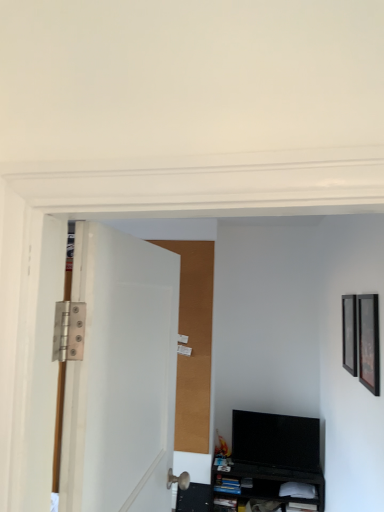
This screenshot has width=384, height=512. Describe the element at coordinates (276, 440) in the screenshot. I see `black glossy tv at lower right` at that location.

Describe the element at coordinates (194, 498) in the screenshot. The image size is (384, 512). I see `black matte shelf at lower center` at that location.

Image resolution: width=384 pixels, height=512 pixels. What do you see at coordinates (369, 342) in the screenshot?
I see `black glossy picture frame at right, the second picture frame when ordered from back to front` at bounding box center [369, 342].

Measure the distance between point (360, 362) and camera.

The distance of point (360, 362) from camera is 2.26 meters.

What are the coordinates of `black matte cabinet at lower center` in the screenshot? It's located at (264, 483).

Does black matte cabinet at lower center have a greater height compared to black matte shelf at lower center?

Correct, black matte cabinet at lower center is much taller as black matte shelf at lower center.

Considering the positions of point (239, 495) and point (188, 487), is point (239, 495) closer or farther from the camera than point (188, 487)?

Point (239, 495) appears to be closer to the viewer than point (188, 487).

Are black matte cabinet at lower center and black matte shelf at lower center beside each other?

They are not placed beside each other.

From the image's perspective, between black matte cabinet at lower center and black matte shelf at lower center, who is located below?

black matte shelf at lower center is shown below in the image.

Is white matte door at left to the left or to the right of black glossy tv at lower right in the image?

white matte door at left is to the left of black glossy tv at lower right.

From the image's perspective, who appears lower, white matte door at left or black glossy tv at lower right?

black glossy tv at lower right is shown below in the image.

Considering the relative sizes of white matte door at left and black glossy tv at lower right in the image provided, is white matte door at left wider than black glossy tv at lower right?

Yes.

Locate an element on the screen. Image resolution: width=384 pixels, height=512 pixels. door below the black glossy picture frame at right, placed as the first picture frame when sorted from left to right (from a real-world perspective) is located at coordinates (121, 375).

From the image's perspective, relative to black glossy picture frame at right, the 2th picture frame from the right, is white matte door at left above or below?

white matte door at left is above black glossy picture frame at right, the 2th picture frame from the right.

Is white matte door at left to the left of black glossy picture frame at right, the 1th picture frame positioned from the front, from the viewer's perspective?

Yes, white matte door at left is to the left of black glossy picture frame at right, the 1th picture frame positioned from the front.

Between point (91, 277) and point (359, 329), which one is positioned in front?

The point (91, 277) is in front.

Is white matte door at left completely or partially inside black glossy picture frame at right, the 1th picture frame positioned from the front?

No, black glossy picture frame at right, the 1th picture frame positioned from the front, does not contain white matte door at left.

Identify the location of door in front of the black glossy picture frame at right, the 2th picture frame from the right. (121, 375).

Between black glossy picture frame at right, the 2th picture frame from the right, and white matte door at left, which one appears on the right side from the viewer's perspective?

Positioned to the right is black glossy picture frame at right, the 2th picture frame from the right.

Based on the photo, can you confirm if black glossy picture frame at right, the 1th picture frame positioned from the front, is shorter than white matte door at left?

Correct, black glossy picture frame at right, the 1th picture frame positioned from the front, is not as tall as white matte door at left.

Are black glossy picture frame at right, the second picture frame when ordered from back to front, and black matte cabinet at lower center making contact?

No, black glossy picture frame at right, the second picture frame when ordered from back to front, is not next to black matte cabinet at lower center.

Could you tell me if black glossy picture frame at right, the second picture frame when ordered from back to front, is turned towards black matte cabinet at lower center?

No, black glossy picture frame at right, the second picture frame when ordered from back to front, is not aimed at black matte cabinet at lower center.

Between point (370, 357) and point (318, 487), which one is positioned in front?

The point (370, 357) is more forward.

Is black glossy picture frame at right, the second picture frame when ordered from back to front, completely or partially outside of black matte cabinet at lower center?

black glossy picture frame at right, the second picture frame when ordered from back to front, lies outside black matte cabinet at lower center's area.

Between black glossy tv at lower right and black glossy picture frame at right, the 1th picture frame positioned from the front, which one has smaller size?

black glossy picture frame at right, the 1th picture frame positioned from the front, is smaller.

Is black glossy tv at lower right facing towards black glossy picture frame at right, the 2th picture frame from the right?

No, black glossy tv at lower right is not turned towards black glossy picture frame at right, the 2th picture frame from the right.

The height and width of the screenshot is (512, 384). Find the location of `television that appears behind the black glossy picture frame at right, the second picture frame when ordered from back to front`. television that appears behind the black glossy picture frame at right, the second picture frame when ordered from back to front is located at coordinates (276, 440).

Is black glossy tv at lower right to the right of black glossy picture frame at right, placed as the first picture frame when sorted from left to right, from the viewer's perspective?

In fact, black glossy tv at lower right is to the left of black glossy picture frame at right, placed as the first picture frame when sorted from left to right.

Is black matte shelf at lower center aimed at black matte cabinet at lower center?

No, black matte shelf at lower center is not turned towards black matte cabinet at lower center.

From a real-world perspective, is black matte shelf at lower center located higher than black matte cabinet at lower center?

No.

Does black matte shelf at lower center appear on the left side of black matte cabinet at lower center?

Yes, black matte shelf at lower center is to the left of black matte cabinet at lower center.

Is black matte shelf at lower center not inside black matte cabinet at lower center?

Indeed, black matte shelf at lower center is completely outside black matte cabinet at lower center.

Identify the location of cabinetry positioned vertically above the black matte shelf at lower center (from a real-world perspective). click(264, 483).

Find the location of a particular element. The height and width of the screenshot is (512, 384). television lying behind the white matte door at left is located at coordinates (276, 440).

Estimate the real-world distances between objects in this image. Which object is further from black matte picture frame at right, the 2th picture frame when ordered from left to right, black glossy tv at lower right or white matte door at left?

black glossy tv at lower right lies further to black matte picture frame at right, the 2th picture frame when ordered from left to right, than the other object.

Considering their positions, is black matte cabinet at lower center positioned closer to black glossy tv at lower right than white matte door at left?

The object closer to black glossy tv at lower right is black matte cabinet at lower center.

Looking at the image, which one is located closer to black matte cabinet at lower center, black glossy picture frame at right, the second picture frame when ordered from back to front, or black matte picture frame at right, the 2th picture frame when ordered from left to right?

black matte picture frame at right, the 2th picture frame when ordered from left to right.

When comparing their distances from white matte door at left, does black matte cabinet at lower center or black matte shelf at lower center seem further?

Among the two, black matte cabinet at lower center is located further to white matte door at left.

Based on the photo, considering their positions, is black glossy tv at lower right positioned closer to white matte door at left than black matte cabinet at lower center?

black glossy tv at lower right is closer to white matte door at left.

Looking at the image, which one is located closer to black matte shelf at lower center, black matte picture frame at right, acting as the 2th picture frame starting from the front, or black glossy tv at lower right?

black glossy tv at lower right is closer to black matte shelf at lower center.

Looking at the image, which one is located further to white matte door at left, black matte shelf at lower center or black glossy tv at lower right?

Based on the image, black matte shelf at lower center appears to be further to white matte door at left.

From the picture: From the image, which object appears to be nearer to black glossy tv at lower right, white matte door at left or black matte shelf at lower center?

black matte shelf at lower center is positioned closer to the anchor black glossy tv at lower right.

This screenshot has width=384, height=512. Find the location of `picture frame between black glossy picture frame at right, the 1th picture frame positioned from the front, and black glossy tv at lower right from front to back`. picture frame between black glossy picture frame at right, the 1th picture frame positioned from the front, and black glossy tv at lower right from front to back is located at coordinates (349, 333).

Locate an element on the screen. picture frame between black glossy picture frame at right, the second picture frame when ordered from back to front, and black matte shelf at lower center from top to bottom is located at coordinates (349, 333).

The width and height of the screenshot is (384, 512). Find the location of `television between black matte picture frame at right, positioned as the 1th picture frame in right-to-left order, and black matte shelf at lower center vertically`. television between black matte picture frame at right, positioned as the 1th picture frame in right-to-left order, and black matte shelf at lower center vertically is located at coordinates (276, 440).

Find the location of a particular element. The image size is (384, 512). television between white matte door at left and black matte shelf at lower center along the z-axis is located at coordinates (276, 440).